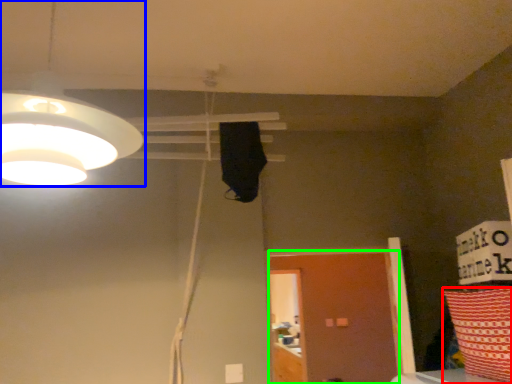
Question: Which object is positioned farthest from pillow (highlighted by a red box)? Select from lamp (highlighted by a blue box) and door (highlighted by a green box).

Choices:
 (A) lamp
 (B) door

Answer: (B)